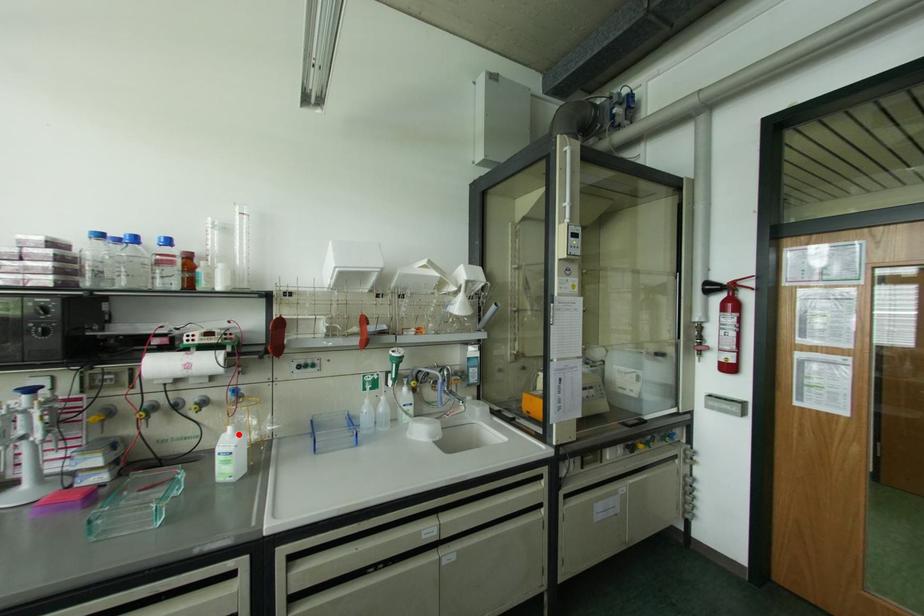
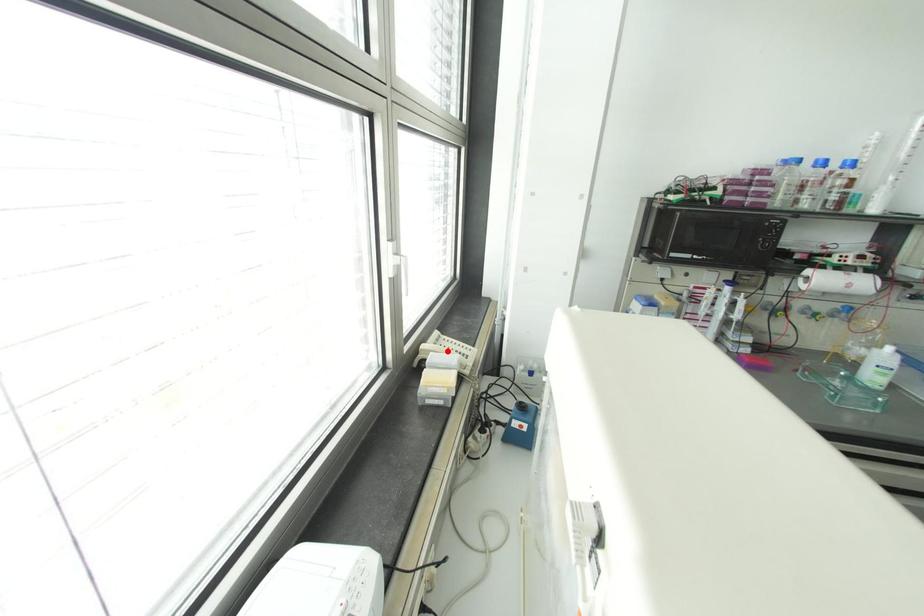
I am providing you with two images of the same scene from different viewpoints. A red point is marked on the first image and another point is marked on the second image. Does the point marked in image1 correspond to the same location as the one in image2?

No